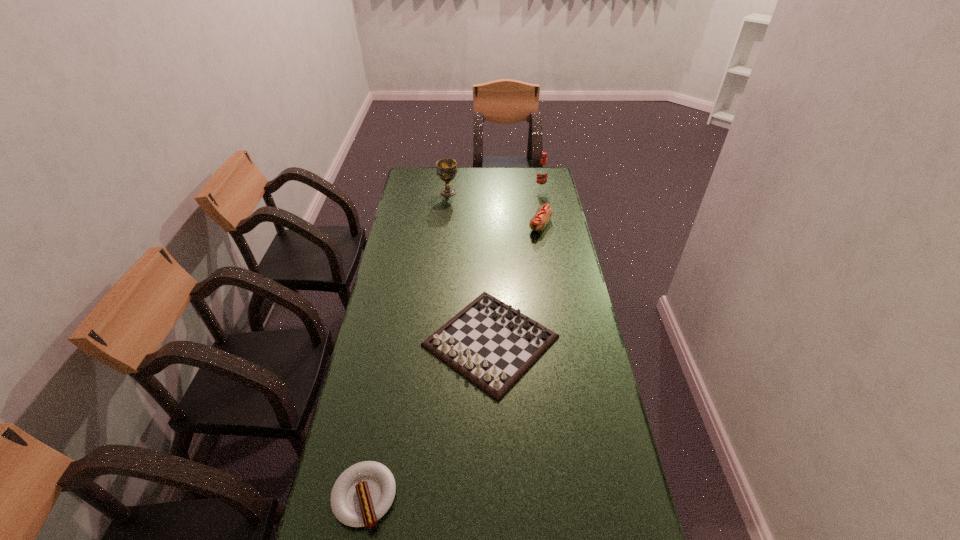
Locate an element on the screen. This screenshot has width=960, height=540. vacant space located on the front of the chessboard is located at coordinates (494, 511).

Where is `free space located 0.260m on the back of the shortest object`? free space located 0.260m on the back of the shortest object is located at coordinates (386, 380).

Locate an element on the screen. The height and width of the screenshot is (540, 960). root beer that is at the far edge is located at coordinates (542, 173).

Where is `chalice that is positioned at the far edge`? chalice that is positioned at the far edge is located at coordinates (446, 168).

Where is `object that is positioned at the left edge`? The image size is (960, 540). object that is positioned at the left edge is located at coordinates (363, 493).

Find the location of a particular element. The width and height of the screenshot is (960, 540). root beer that is at the right edge is located at coordinates (542, 173).

Image resolution: width=960 pixels, height=540 pixels. Find the location of `sausage present at the right edge`. sausage present at the right edge is located at coordinates (544, 213).

Image resolution: width=960 pixels, height=540 pixels. I want to click on chessboard located at the right edge, so click(x=491, y=344).

Find the location of a particular element. This screenshot has width=960, height=540. object at the far right corner is located at coordinates (542, 173).

In order to click on vacant space at the far edge in this screenshot , I will do `click(455, 187)`.